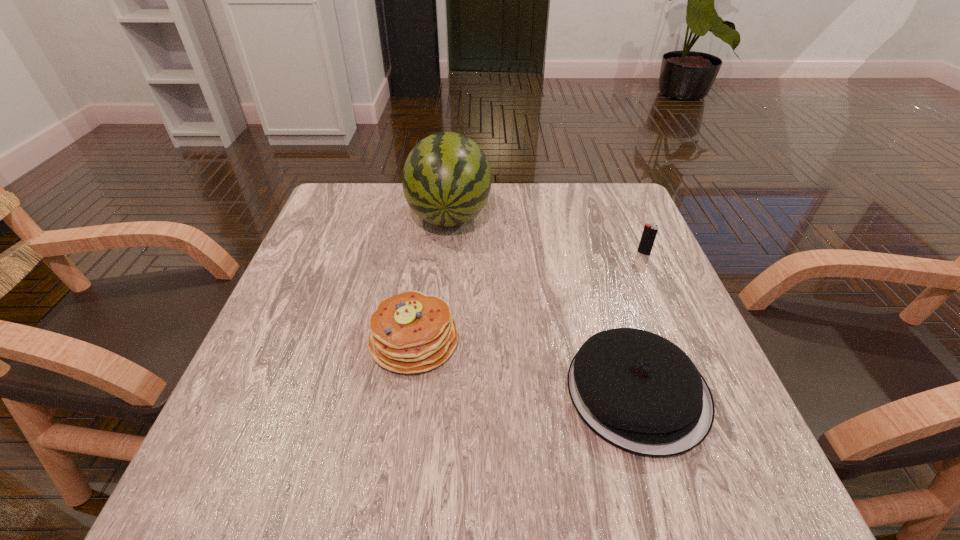
Image resolution: width=960 pixels, height=540 pixels. In the image, there is a desktop. Find the location of `vacant space at the far right corner`. vacant space at the far right corner is located at coordinates (576, 199).

The width and height of the screenshot is (960, 540). In the image, there is a desktop. In order to click on vacant space at the near right corner in this screenshot , I will do `click(661, 458)`.

The height and width of the screenshot is (540, 960). I want to click on vacant area between the second farthest object and the taller pancake, so click(x=529, y=296).

I want to click on vacant region between the farthest object and the taller pancake, so click(432, 277).

I want to click on free area in between the tallest object and the taller pancake, so tap(432, 277).

Locate an element on the screen. The image size is (960, 540). empty location between the third nearest object and the watermelon is located at coordinates (546, 234).

This screenshot has height=540, width=960. Identify the location of vacant space in between the watermelon and the third nearest object. (546, 234).

In order to click on vacant area that lies between the second farthest object and the watermelon in this screenshot , I will do `click(546, 234)`.

The image size is (960, 540). Find the location of `vacant point located between the right pancake and the igniter`. vacant point located between the right pancake and the igniter is located at coordinates (640, 322).

Locate an element on the screen. Image resolution: width=960 pixels, height=540 pixels. unoccupied area between the shorter pancake and the tallest object is located at coordinates (543, 303).